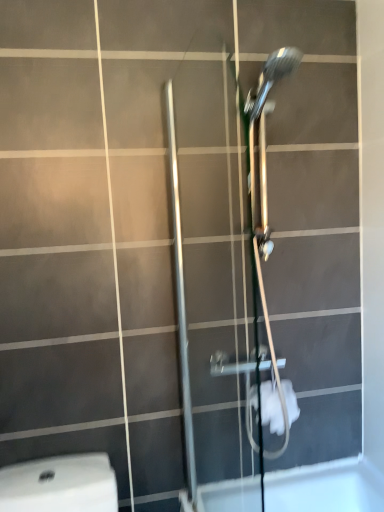
Question: Is point (269, 381) positioned closer to the camera than point (218, 359)?

Choices:
 (A) closer
 (B) farther

Answer: (B)

Question: Considering the positions of white fabric toilet paper at lower center and satin nickel shower door at center in the image, is white fabric toilet paper at lower center wider or thinner than satin nickel shower door at center?

Choices:
 (A) thin
 (B) wide

Answer: (B)

Question: In terms of height, does white fabric toilet paper at lower center look taller or shorter compared to satin nickel shower door at center?

Choices:
 (A) tall
 (B) short

Answer: (B)

Question: In the image, is satin nickel shower door at center positioned in front of or behind white fabric toilet paper at lower center?

Choices:
 (A) front
 (B) behind

Answer: (A)

Question: From the image's perspective, is satin nickel shower door at center located above or below white fabric toilet paper at lower center?

Choices:
 (A) above
 (B) below

Answer: (A)

Question: Based on their sizes in the image, would you say satin nickel shower door at center is bigger or smaller than white fabric toilet paper at lower center?

Choices:
 (A) small
 (B) big

Answer: (B)

Question: Considering the positions of satin nickel shower door at center and white fabric toilet paper at lower center in the image, is satin nickel shower door at center taller or shorter than white fabric toilet paper at lower center?

Choices:
 (A) short
 (B) tall

Answer: (B)